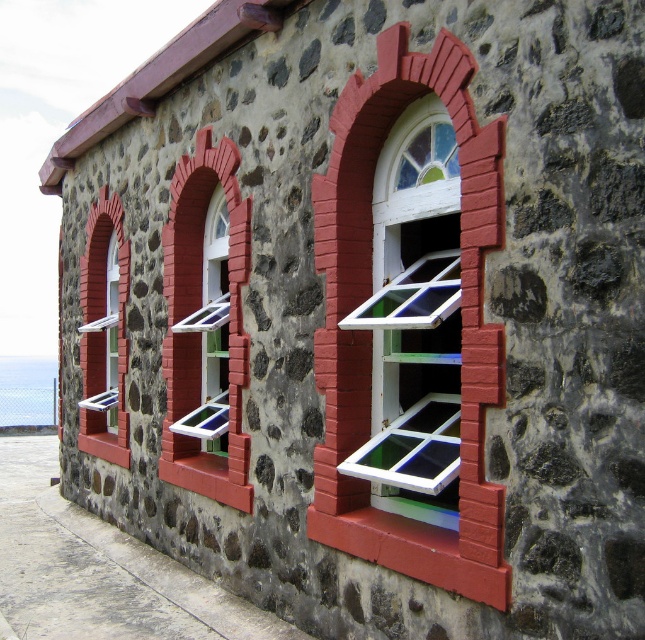
You are an architect inspecting the building facade. You notice the white painted wood at center and the matte glass window at center. Which object is closer to you from your current viewpoint?

The white painted wood at center is closer to you because it is in front of the matte glass window at center.